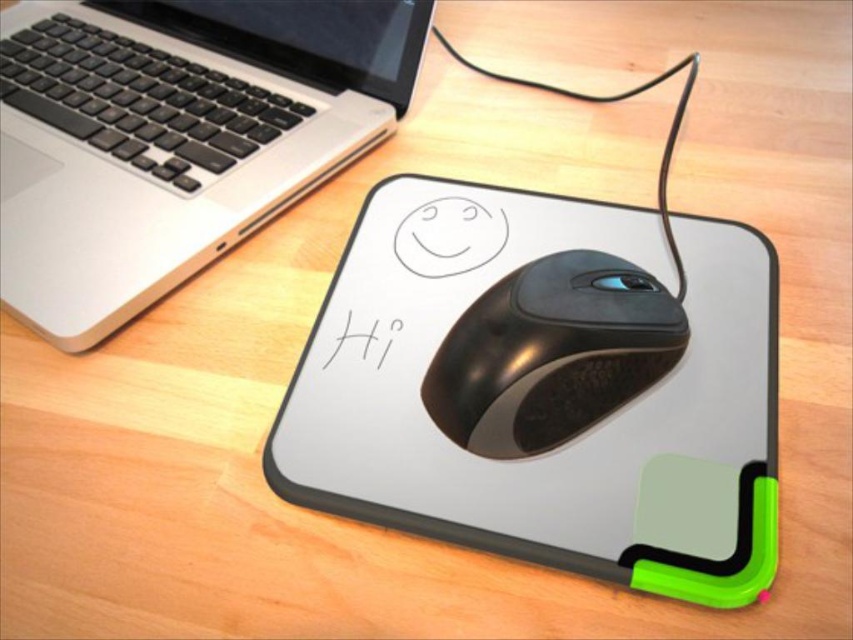
You are a photographer setting up a shot of the workspace. You need to place a small sticker exactly halfway between the two points, point (711,312) and point (686,339). Considering their positions, where should the sticker be placed in relation to the mousepad?

The sticker should be placed closer to point (711,312) because it is closer to the camera than point (686,339). Since the sticker is halfway between them, it will be positioned between the two points but nearer to the closer one.

You are a delivery robot with a height of 24 inches. You need to place a package on the workspace shown in the image. The package is 12 inches tall and must be placed so that it doesn not block the view of the satin silver laptop at upper left. Can you do it?

The satin silver laptop at upper left is 18.98 inches away from the camera. Since the package is 12 inches tall, placing it on the workspace would not block the view of the laptop as long as it is positioned appropriately, ensuring the laptop remains visible from the camera perspective.